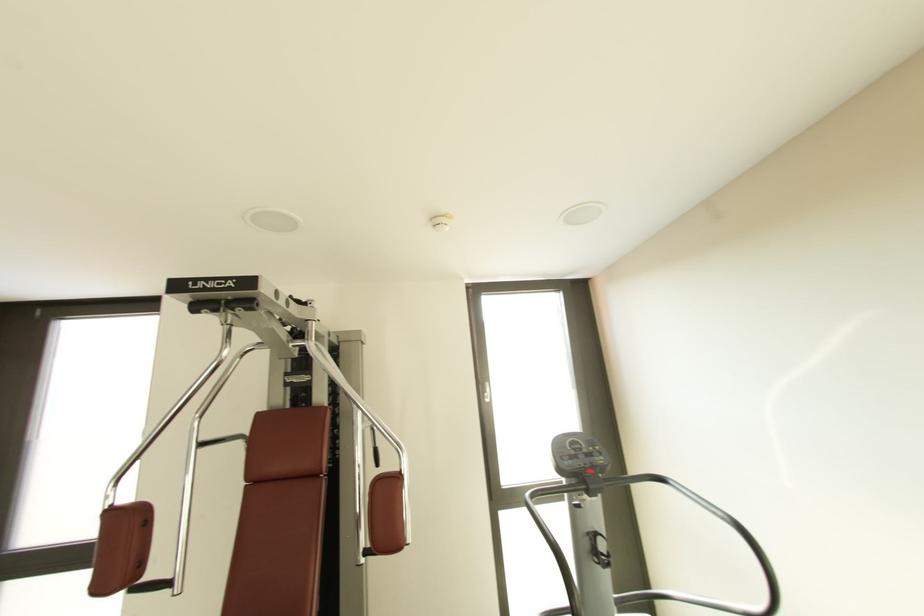
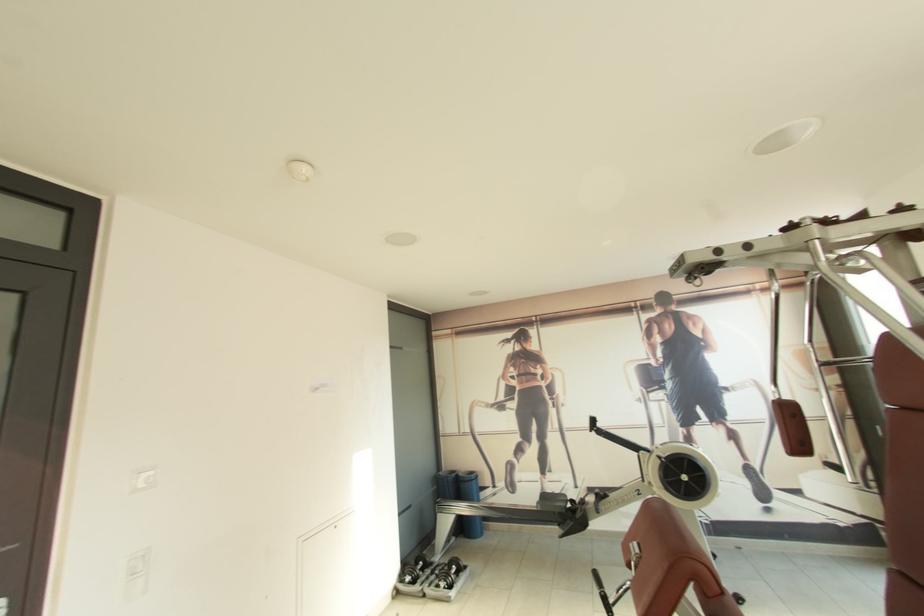
In the second image, find the point that corresponds to [116,507] in the first image.

(784, 400)